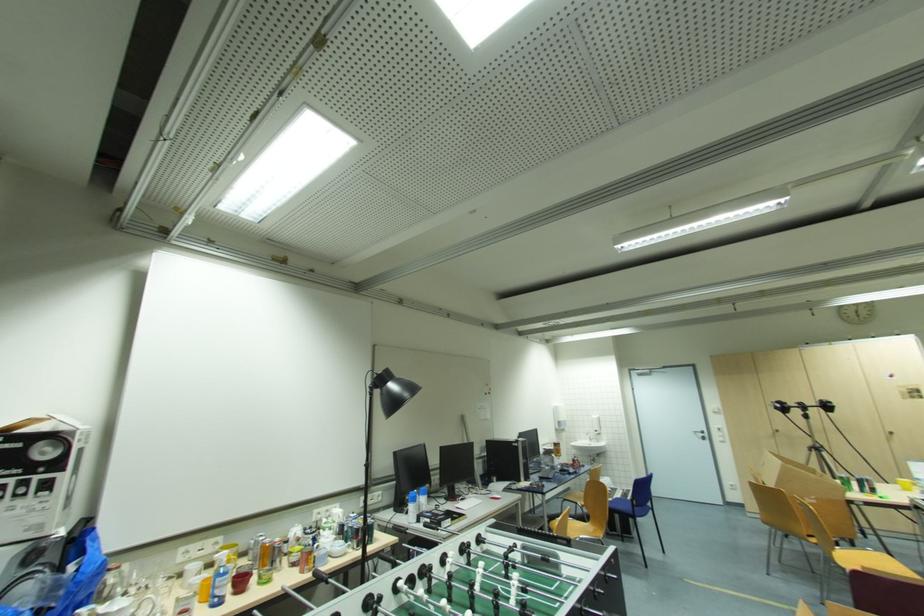
Find the location of a particular element. orange plastic bottle is located at coordinates (264, 554).